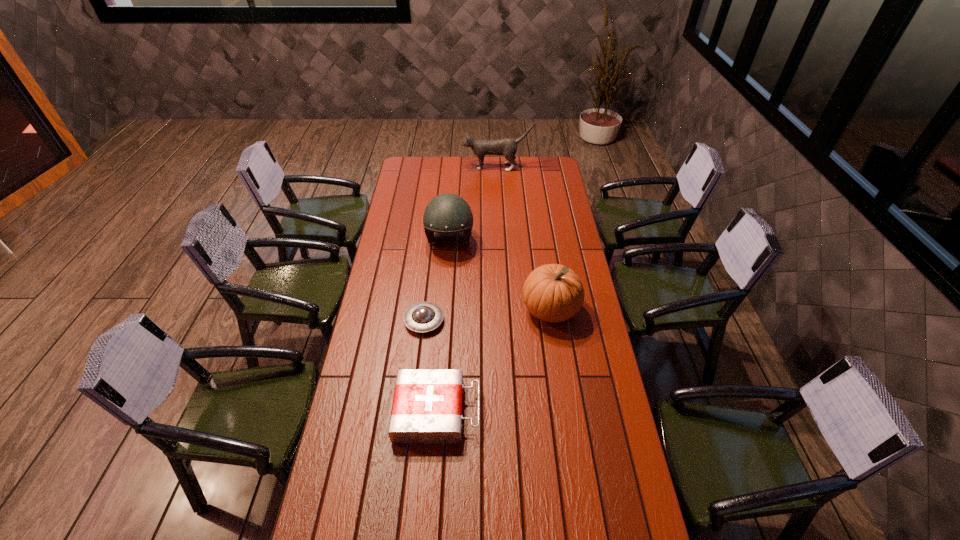
Locate an element on the screen. the farthest object is located at coordinates (508, 147).

Image resolution: width=960 pixels, height=540 pixels. In order to click on pumpkin in this screenshot , I will do `click(554, 293)`.

At what (x,y) coordinates should I click in order to perform the action: click on the second farthest object. Please return your answer as a coordinate pair (x, y). Image resolution: width=960 pixels, height=540 pixels. Looking at the image, I should click on (447, 213).

This screenshot has height=540, width=960. I want to click on the nearest object, so click(x=427, y=405).

Find the location of a particular element. The image size is (960, 540). saucer is located at coordinates (421, 317).

You are a GUI agent. You are given a task and a screenshot of the screen. Output one action in this format:
    pyautogui.click(x=<x>, y=<y>)
    Task: Click on the vacant position located at the face of the cat
    This screenshot has height=540, width=960.
    Given the screenshot: What is the action you would take?
    pyautogui.click(x=450, y=167)

Image resolution: width=960 pixels, height=540 pixels. I want to click on vacant space located 0.180m at the face of the cat, so click(x=432, y=167).

The height and width of the screenshot is (540, 960). I want to click on vacant space located 0.070m at the face of the cat, so click(450, 167).

Where is `free space located on the stem of the pumpkin`? free space located on the stem of the pumpkin is located at coordinates (560, 373).

In order to click on vacant region located at the face opening of the second farthest object in this screenshot , I will do `click(445, 298)`.